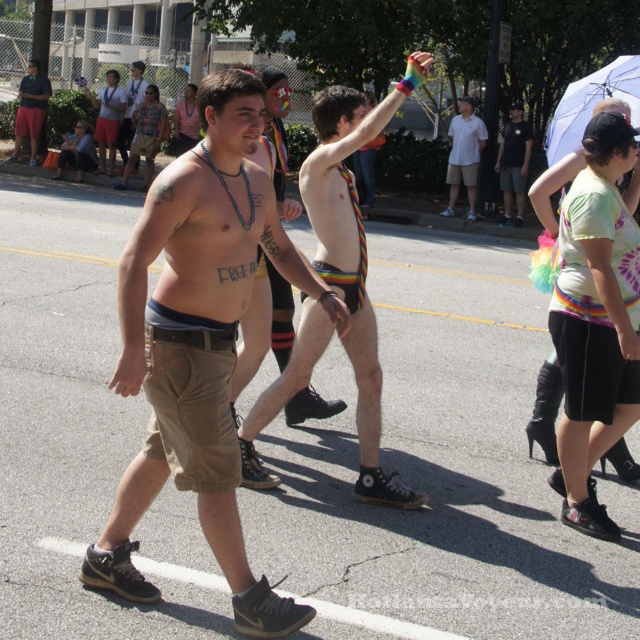
Question: Which of the following is the farthest from the observer?

Choices:
 (A) white cotton shirt at center
 (B) rainbow striped underwear at center
 (C) matte black shorts at upper left
 (D) black cotton shirt at center

Answer: (C)

Question: Is rainbow striped underwear at center further to camera compared to matte black shorts at center?

Choices:
 (A) yes
 (B) no

Answer: (B)

Question: Is khaki shorts at center further to camera compared to matte black shorts at center?

Choices:
 (A) no
 (B) yes

Answer: (A)

Question: Which point is closer to the camera taking this photo?

Choices:
 (A) (145, 84)
 (B) (454, 195)

Answer: (B)

Question: Where is black cotton shirt at center located in relation to matte black shorts at upper left in the image?

Choices:
 (A) right
 (B) left

Answer: (A)

Question: Estimate the real-world distances between objects in this image. Which object is farther from the khaki shorts at center?

Choices:
 (A) black cotton shirt at center
 (B) rainbow striped underwear at center

Answer: (A)